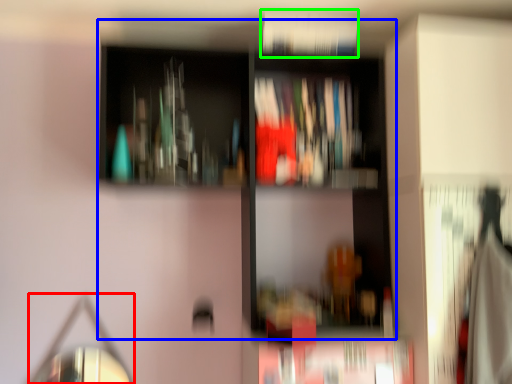
Question: Based on their relative distances, which object is farther from mirror (highlighted by a red box)? Choose from bookcase (highlighted by a blue box) and book (highlighted by a green box).

Choices:
 (A) bookcase
 (B) book

Answer: (B)